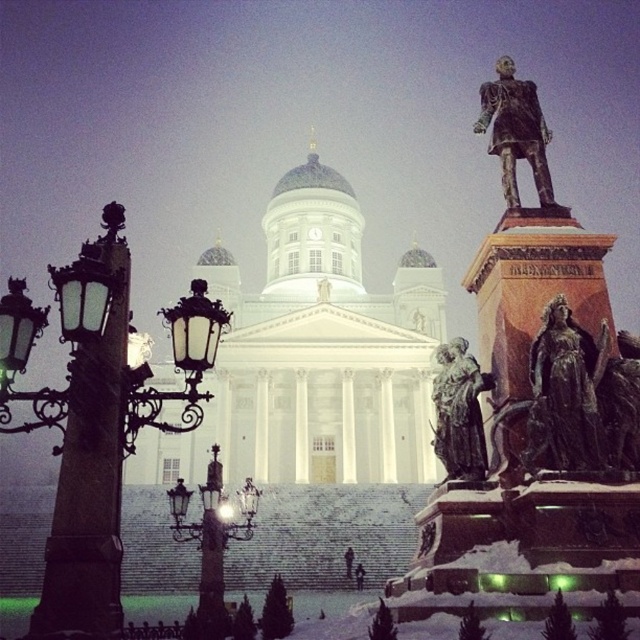
Does bronze statue at right have a smaller size compared to bronze statue at center-right?

Yes.

Is bronze statue at right below bronze statue at center-right?

No.

Does point (513, 248) lie behind point (467, 467)?

Yes, it is behind point (467, 467).

Where is `bronze statue at right`? bronze statue at right is located at coordinates (x=540, y=397).

Can you confirm if bronze statue at right is positioned above matte black lamp post at left?

Yes, bronze statue at right is above matte black lamp post at left.

Between bronze statue at right and matte black lamp post at left, which one has less height?

bronze statue at right

Image resolution: width=640 pixels, height=640 pixels. Find the location of `bronze statue at right`. bronze statue at right is located at coordinates (540, 397).

Looking at this image, is matte black lamp post at left thinner than bronze statue at upper right?

In fact, matte black lamp post at left might be wider than bronze statue at upper right.

Between matte black lamp post at left and bronze statue at upper right, which one has more height?

matte black lamp post at left

Find the location of a particular element. The height and width of the screenshot is (640, 640). matte black lamp post at left is located at coordinates point(90,474).